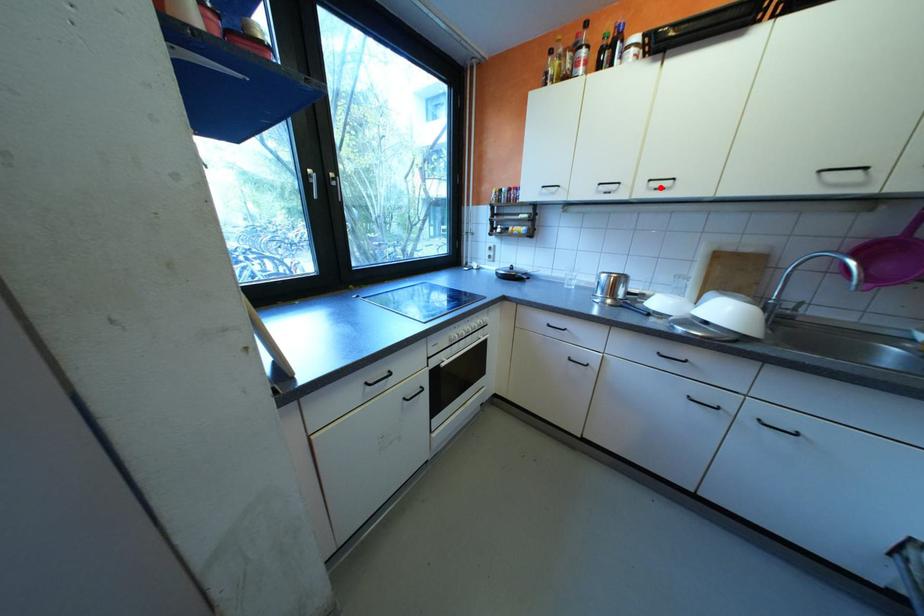
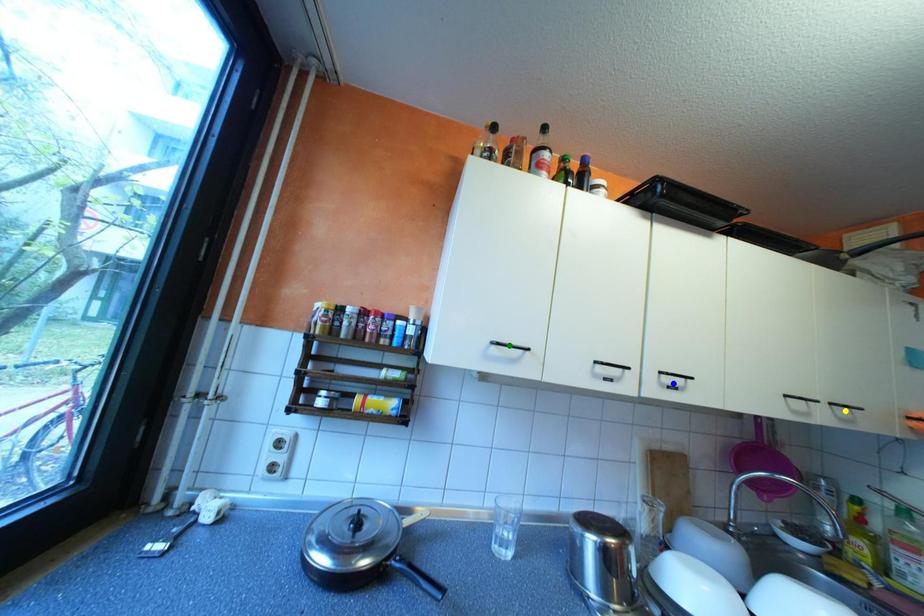
Question: I am providing you with two images of the same scene from different viewpoints. A red point is marked on the first image. You are given multiple points on the second image. Which spot in image 2 lines up with the point in image 1?

Choices:
 (A) green point
 (B) blue point
 (C) yellow point

Answer: (B)